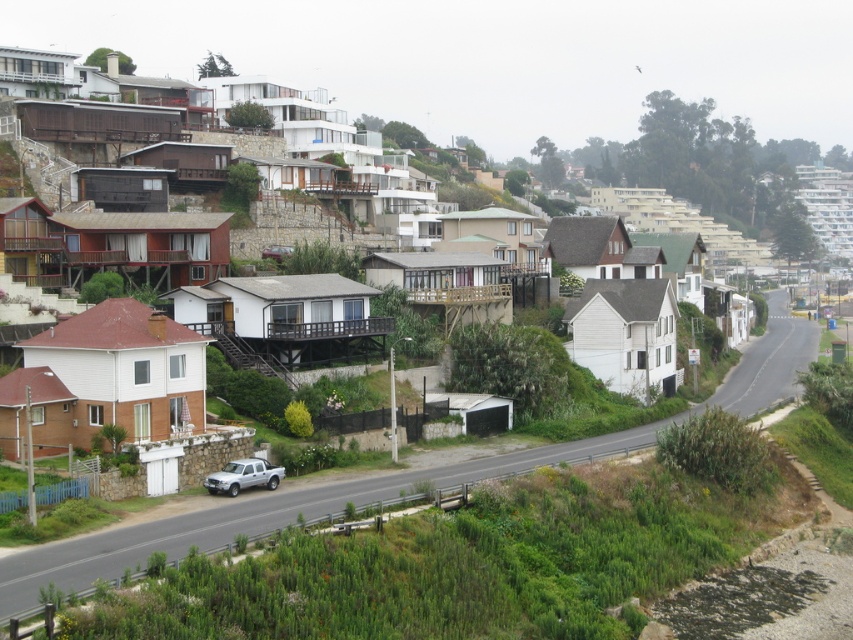
Question: From the image, what is the correct spatial relationship of white matte house at center in relation to metallic maroon car at center?

Choices:
 (A) below
 (B) above

Answer: (B)

Question: Which of the following is the farthest from the observer?

Choices:
 (A) (286, 248)
 (B) (222, 256)

Answer: (A)

Question: Can you confirm if white matte house at center is smaller than metallic maroon car at center?

Choices:
 (A) no
 (B) yes

Answer: (A)

Question: Which of the following is the closest to the observer?

Choices:
 (A) (276, 250)
 (B) (24, 275)
 (C) (254, 461)

Answer: (C)

Question: Which point is farther to the camera?

Choices:
 (A) (281, 257)
 (B) (204, 189)
 (C) (256, 460)

Answer: (B)

Question: Is white matte house at center below metallic maroon car at center?

Choices:
 (A) yes
 (B) no

Answer: (B)